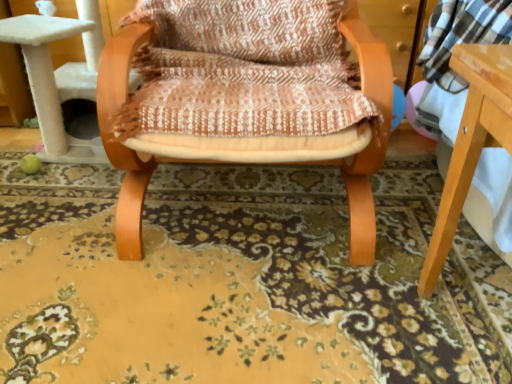
Question: Is floral carpet at center bigger than wooden chair at center?

Choices:
 (A) yes
 (B) no

Answer: (B)

Question: Is floral carpet at center at the right side of wooden chair at center?

Choices:
 (A) no
 (B) yes

Answer: (A)

Question: From the image's perspective, is floral carpet at center over wooden chair at center?

Choices:
 (A) no
 (B) yes

Answer: (A)

Question: Can you confirm if floral carpet at center is taller than wooden chair at center?

Choices:
 (A) no
 (B) yes

Answer: (A)

Question: Is floral carpet at center further to camera compared to wooden chair at center?

Choices:
 (A) yes
 (B) no

Answer: (A)

Question: From a real-world perspective, is floral carpet at center physically above wooden chair at center?

Choices:
 (A) no
 (B) yes

Answer: (A)

Question: Considering the relative positions of wooden chair at center and floral carpet at center in the image provided, is wooden chair at center to the right of floral carpet at center from the viewer's perspective?

Choices:
 (A) yes
 (B) no

Answer: (A)

Question: Does wooden chair at center appear on the left side of floral carpet at center?

Choices:
 (A) yes
 (B) no

Answer: (B)

Question: Can you confirm if wooden chair at center is bigger than floral carpet at center?

Choices:
 (A) yes
 (B) no

Answer: (A)

Question: From a real-world perspective, is wooden chair at center physically above floral carpet at center?

Choices:
 (A) no
 (B) yes

Answer: (B)

Question: Does wooden chair at center lie in front of floral carpet at center?

Choices:
 (A) yes
 (B) no

Answer: (A)

Question: Is the depth of wooden chair at center greater than that of floral carpet at center?

Choices:
 (A) yes
 (B) no

Answer: (B)

Question: Considering the positions of floral carpet at center and wooden chair at center in the image, is floral carpet at center taller or shorter than wooden chair at center?

Choices:
 (A) short
 (B) tall

Answer: (A)